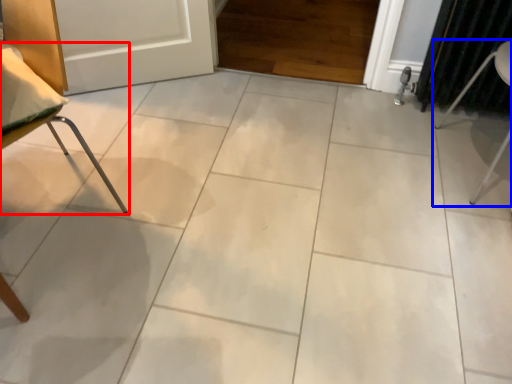
Question: Which of the following is the farthest to the observer, furniture (highlighted by a red box) or furniture (highlighted by a blue box)?

Choices:
 (A) furniture
 (B) furniture

Answer: (B)